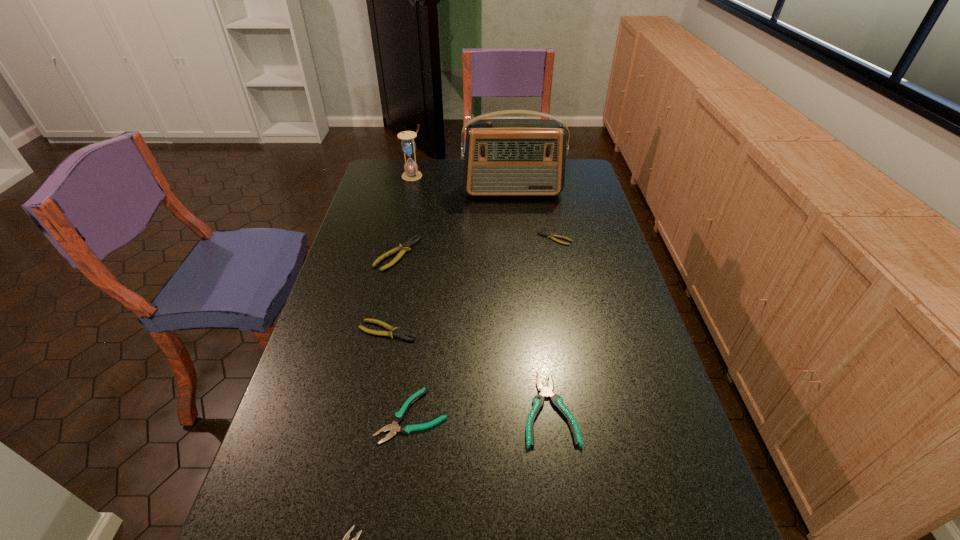
This screenshot has width=960, height=540. In order to click on hourglass present at the left edge in this screenshot , I will do `click(408, 145)`.

At what (x,y) coordinates should I click in order to perform the action: click on radio receiver that is at the right edge. Please return your answer as a coordinate pair (x, y). Looking at the image, I should click on (503, 157).

Find the location of a particular element. This screenshot has width=960, height=540. pliers located at the right edge is located at coordinates (551, 236).

Find the location of a particular element. Image resolution: width=960 pixels, height=540 pixels. object that is at the far left corner is located at coordinates (408, 145).

Where is `object at the far right corner`? The image size is (960, 540). object at the far right corner is located at coordinates (503, 157).

Find the location of a particular element. The height and width of the screenshot is (540, 960). free spot at the far edge of the desktop is located at coordinates (455, 179).

Locate an element on the screen. Image resolution: width=960 pixels, height=540 pixels. free spot at the left edge of the desktop is located at coordinates (358, 293).

You are a GUI agent. You are given a task and a screenshot of the screen. Output one action in this format:
    pyautogui.click(x=<x>, y=<y>)
    Task: Click on the vacant region at the right edge of the desktop
    This screenshot has width=960, height=540.
    Given the screenshot: What is the action you would take?
    pyautogui.click(x=632, y=411)

Identify the location of vacant space at the far left corner of the desktop. The image size is (960, 540). (375, 180).

At what (x,y) coordinates should I click in order to perform the action: click on empty location between the tallest object and the biggest teal pliers. Please return your answer as a coordinate pair (x, y). This screenshot has height=540, width=960. Looking at the image, I should click on (x=531, y=300).